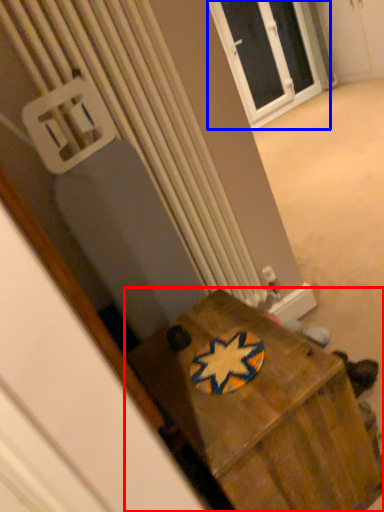
Question: Which object is closer to the camera taking this photo, furniture (highlighted by a red box) or window (highlighted by a blue box)?

Choices:
 (A) furniture
 (B) window

Answer: (A)